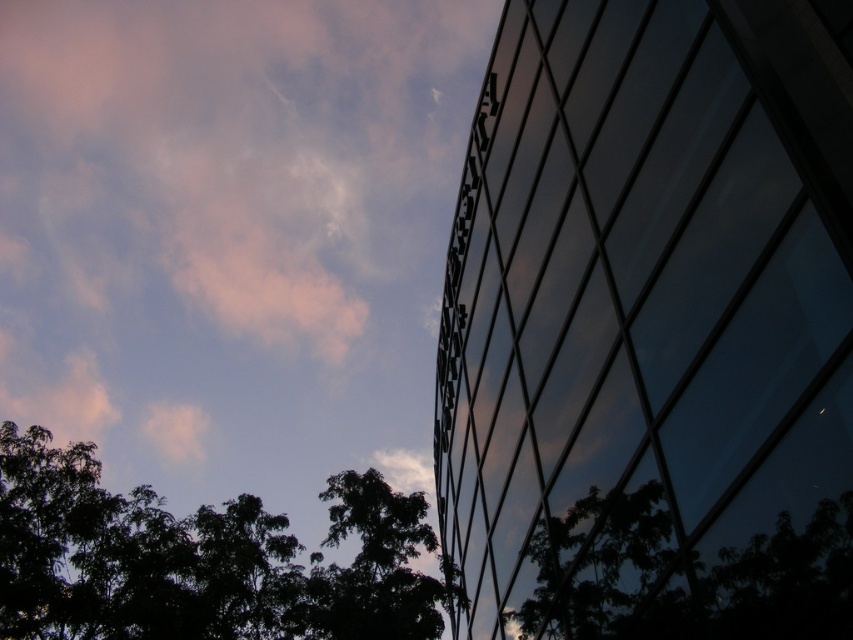
Based on the photo, which is below, dark green leafy tree at lower left or dark green leafy tree at lower right?

dark green leafy tree at lower left

Is dark green leafy tree at lower left smaller than dark green leafy tree at lower right?

Actually, dark green leafy tree at lower left might be larger than dark green leafy tree at lower right.

At what (x,y) coordinates should I click in order to perform the action: click on dark green leafy tree at lower left. Please return your answer as a coordinate pair (x, y). Looking at the image, I should click on (198, 560).

Is transparent glass window at upper right to the left of dark green leafy tree at lower right from the viewer's perspective?

Indeed, transparent glass window at upper right is positioned on the left side of dark green leafy tree at lower right.

Can you confirm if transparent glass window at upper right is positioned to the right of dark green leafy tree at lower right?

No, transparent glass window at upper right is not to the right of dark green leafy tree at lower right.

Is point (508, 358) more distant than point (680, 568)?

Yes.

At what (x,y) coordinates should I click in order to perform the action: click on transparent glass window at upper right. Please return your answer as a coordinate pair (x, y). Looking at the image, I should click on (653, 324).

Does transparent glass window at upper right appear over pink cloud at upper left?

No.

Is transparent glass window at upper right thinner than pink cloud at upper left?

Yes.

Measure the distance between transparent glass window at upper right and camera.

A distance of 5.11 meters exists between transparent glass window at upper right and camera.

Find the location of a particular element. Image resolution: width=853 pixels, height=640 pixels. transparent glass window at upper right is located at coordinates (653, 324).